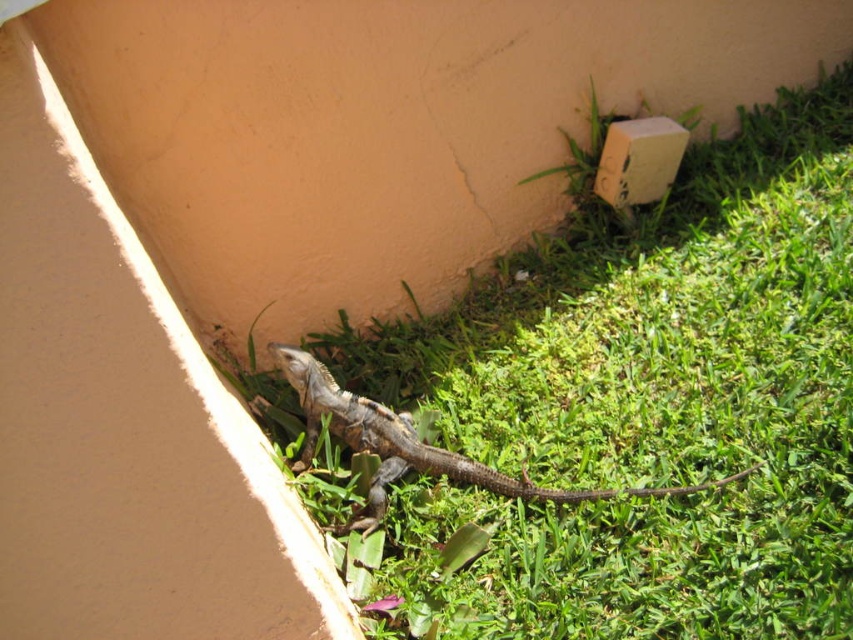
You are standing at the point marked by the electrical box on the beige wall. You see two points in the scene labeled as point 1 at coordinates point (315, 406) and point 2 at coordinates point (608, 157). Which point is closer to you?

Point 1 at coordinates point (315, 406) is closer to you because it is in front of point 2 at coordinates point (608, 157).

You are a gardener who needs to place a new plant pot that is 10 cm tall. You see the brown scaly lizard at lower center and the beige cardboard box at upper right. Which object is shorter, so the plant pot can be placed next to it without blocking the view?

The beige cardboard box at upper right is shorter than the brown scaly lizard at lower center, so the plant pot can be placed next to the beige cardboard box at upper right without blocking the view.

You are standing at the origin point in the scene. Which of the two points, point (788,250) or point (614,128), is closer to you?

Point (614,128) is closer to you because it is behind point (788,250), meaning the latter is further away.